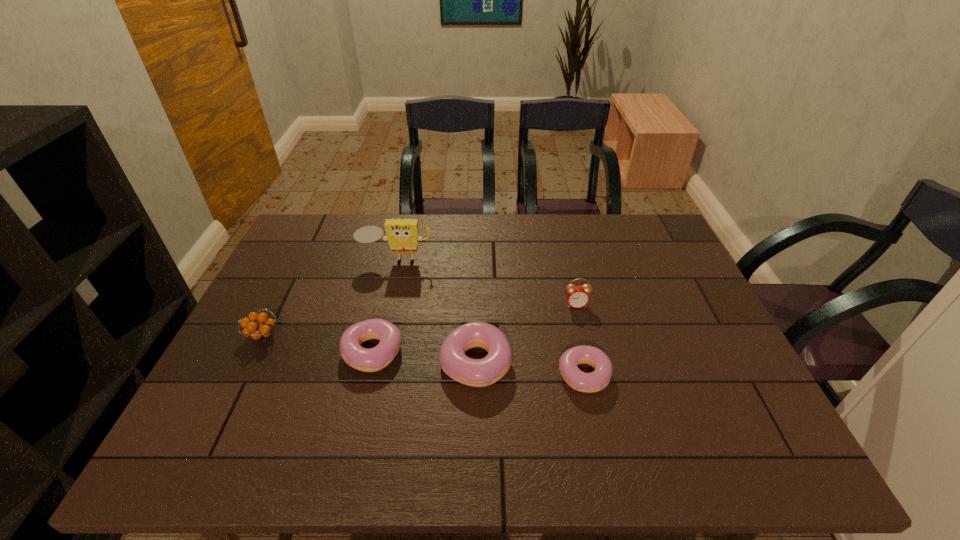
Given the evenly spaced doughnuts in the image, where should an extra doughnut be added on the right to preserve the spacing? Please point to a vacant space. Please provide its 2D coordinates. Your answer should be formatted as a tuple, i.e. [(x, y)], where the tuple contains the x and y coordinates of a point satisfying the conditions above.

[(698, 387)]